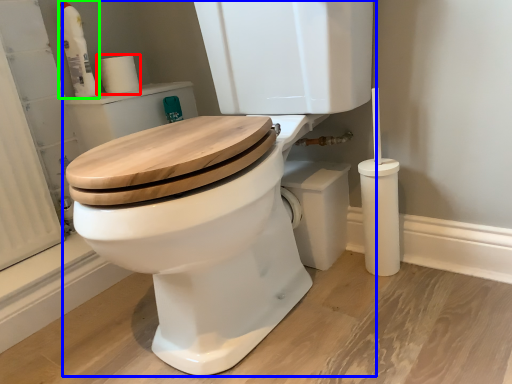
Question: Which object is the farthest from toilet paper (highlighted by a red box)? Choose among these: toilet (highlighted by a blue box) or cleaning product (highlighted by a green box).

Choices:
 (A) toilet
 (B) cleaning product

Answer: (A)